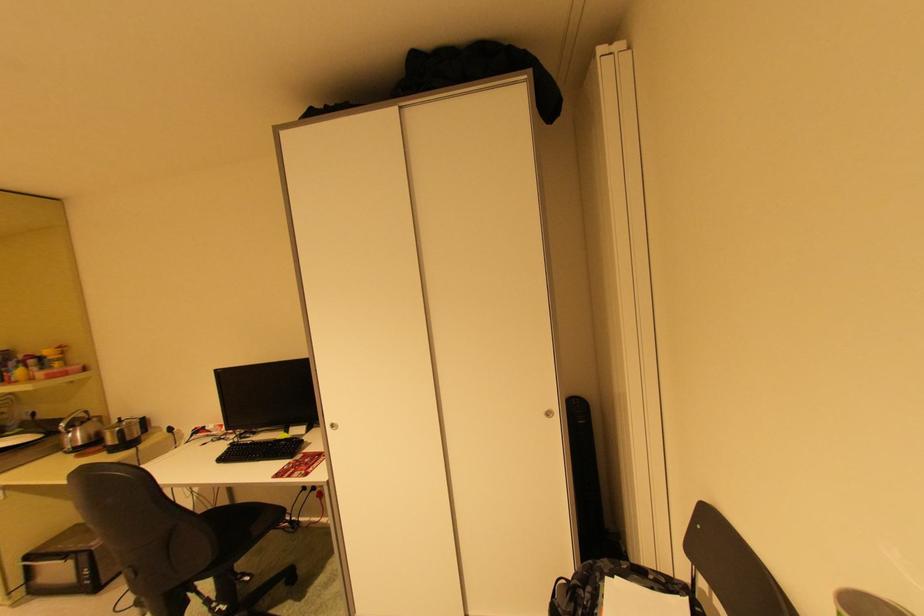
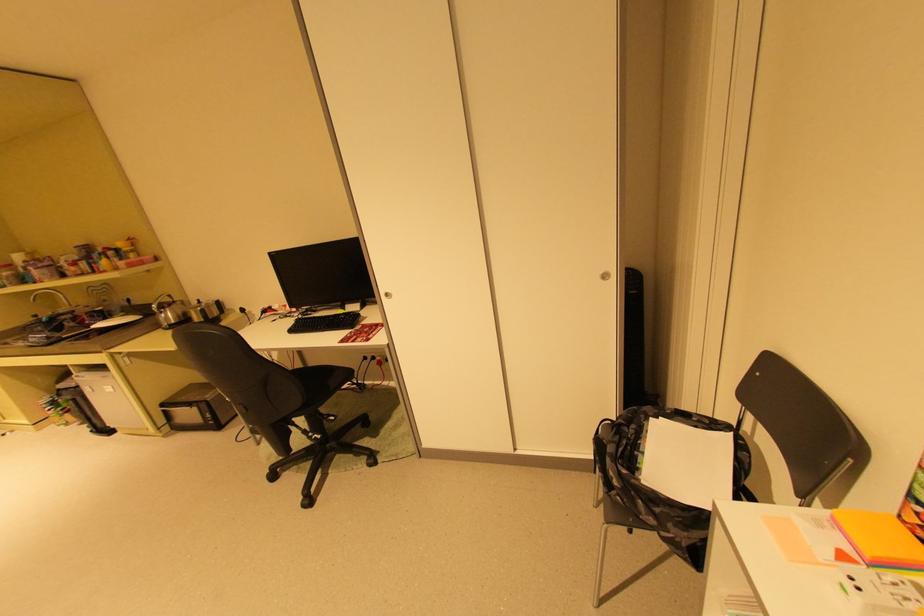
The images are taken continuously from a first-person perspective. In which direction are you moving?

The movement direction of the cameraman is left, forward.